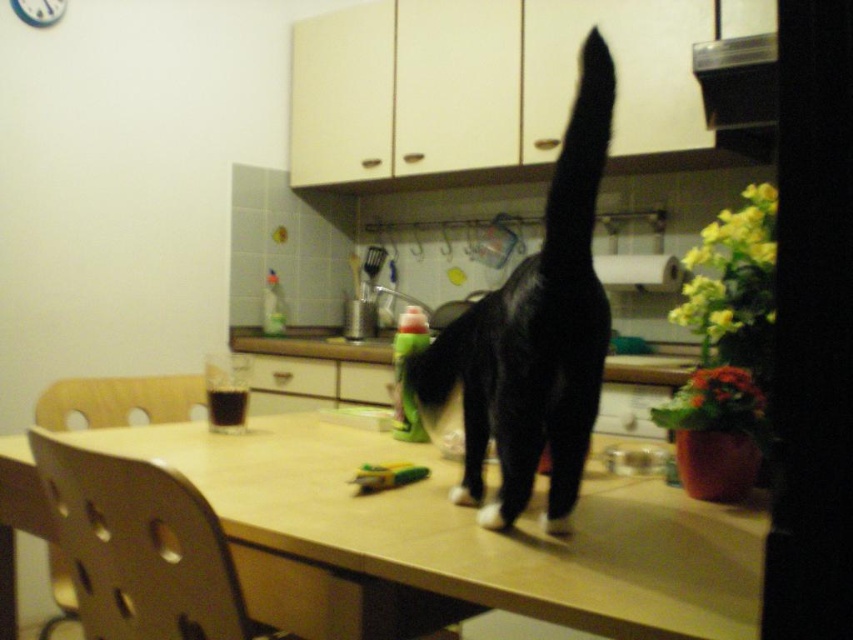
Question: Estimate the real-world distances between objects in this image. Which object is farther from the black fur cat at center?

Choices:
 (A) light brown wooden table at center
 (B) black matte tail at upper center

Answer: (A)

Question: Is light brown wooden table at center closer to the viewer compared to black fur cat at center?

Choices:
 (A) yes
 (B) no

Answer: (A)

Question: Where is light brown wooden table at center located in relation to black fur cat at center in the image?

Choices:
 (A) right
 (B) left

Answer: (B)

Question: Can you confirm if light brown wooden table at center is bigger than black matte tail at upper center?

Choices:
 (A) yes
 (B) no

Answer: (A)

Question: Which point is closer to the camera?

Choices:
 (A) (564, 276)
 (B) (590, 420)
 (C) (404, 506)

Answer: (A)

Question: Among these objects, which one is farthest from the camera?

Choices:
 (A) black fur cat at center
 (B) light brown wooden table at center

Answer: (A)